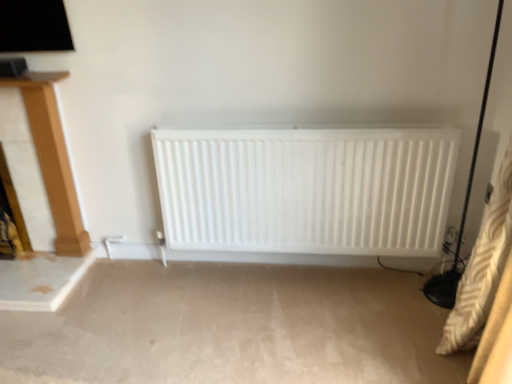
Question: Looking at their shapes, would you say white matte radiator at center is wider or thinner than wooden fireplace at left?

Choices:
 (A) thin
 (B) wide

Answer: (B)

Question: Is point pos(433,155) positioned closer to the camera than point pos(53,192)?

Choices:
 (A) farther
 (B) closer

Answer: (B)

Question: From the image's perspective, is white matte radiator at center above or below wooden fireplace at left?

Choices:
 (A) below
 (B) above

Answer: (A)

Question: From a real-world perspective, is wooden fireplace at left positioned above or below white matte radiator at center?

Choices:
 (A) above
 (B) below

Answer: (A)

Question: In terms of size, does wooden fireplace at left appear bigger or smaller than white matte radiator at center?

Choices:
 (A) small
 (B) big

Answer: (A)

Question: From the image's perspective, is wooden fireplace at left above or below white matte radiator at center?

Choices:
 (A) below
 (B) above

Answer: (B)

Question: Is point (52, 79) closer or farther from the camera than point (187, 223)?

Choices:
 (A) closer
 (B) farther

Answer: (A)